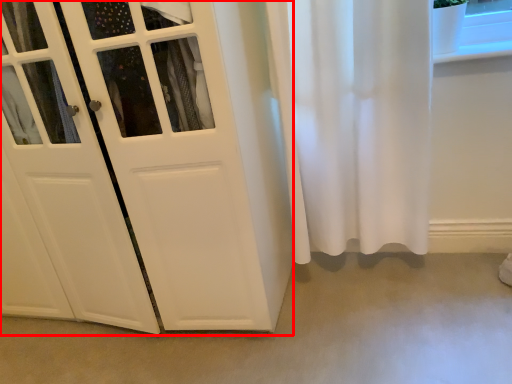
Question: In this image, where is door (annotated by the red box) located relative to concrete?

Choices:
 (A) left
 (B) right

Answer: (A)